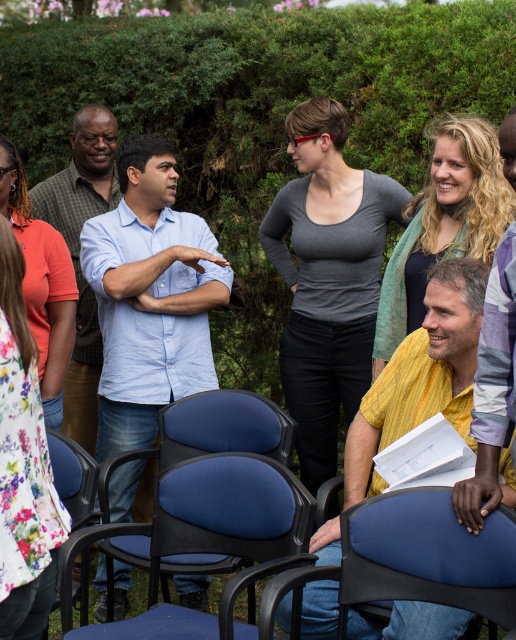
Between blonde hair scarf at upper right and blue fabric chair at lower left, which one has more height?

With more height is blonde hair scarf at upper right.

What do you see at coordinates (445, 224) in the screenshot? I see `blonde hair scarf at upper right` at bounding box center [445, 224].

Does point (410, 248) lie behind point (96, 474)?

That is True.

This screenshot has width=516, height=640. In order to click on blonde hair scarf at upper right in this screenshot , I will do `click(445, 224)`.

Is blue fabric chair at center further to the viewer compared to blonde hair scarf at upper right?

No, it is not.

Who is more forward, (280,529) or (409,244)?

Positioned in front is point (280,529).

Identify the location of blue fabric chair at center. (217, 538).

Which is in front, point (349, 500) or point (85, 179)?

Positioned in front is point (349, 500).

Does point (349, 614) come behind point (63, 170)?

No.

At what (x,y) coordinates should I click in order to perform the action: click on yellow woven scarf at center. Please return your answer as a coordinate pair (x, y). This screenshot has width=516, height=640. Looking at the image, I should click on (422, 372).